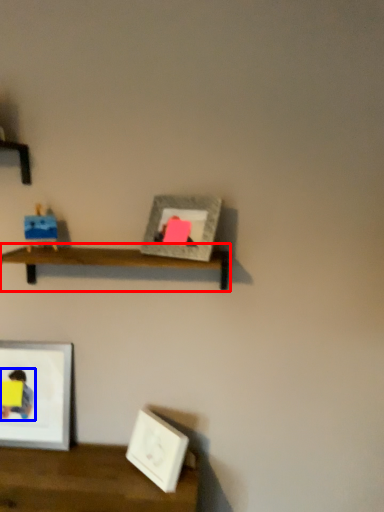
Question: Which of the following is the closest to the observer, shelf (highlighted by a red box) or person (highlighted by a blue box)?

Choices:
 (A) shelf
 (B) person

Answer: (A)